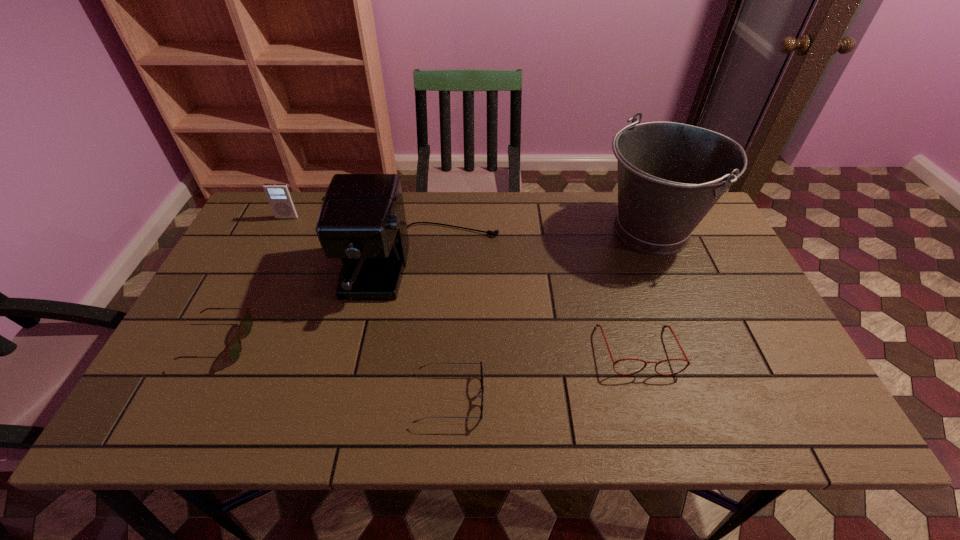
The image size is (960, 540). I want to click on unoccupied area between the iPod and the rightmost spectacles, so click(463, 284).

The image size is (960, 540). Identify the location of vacant space that's between the fourth shortest object and the leftmost spectacles. (253, 280).

Where is `empty space between the iPod and the leftmost spectacles`? empty space between the iPod and the leftmost spectacles is located at coordinates (253, 280).

What are the coordinates of `free point between the bucket and the tallest spectacles` in the screenshot? It's located at (645, 291).

Locate an element on the screen. The width and height of the screenshot is (960, 540). empty space that is in between the third shortest object and the leftmost spectacles is located at coordinates (428, 346).

In order to click on vacant area between the tallest object and the iPod in this screenshot , I will do `click(470, 225)`.

You are a GUI agent. You are given a task and a screenshot of the screen. Output one action in this format:
    pyautogui.click(x=<x>, y=<y>)
    Task: Click on the blank region between the fourth shortest object and the tallest object
    
    Given the screenshot: What is the action you would take?
    pyautogui.click(x=470, y=225)

Where is `free space between the leftmost spectacles and the second spectacles from left to right`? The height and width of the screenshot is (540, 960). free space between the leftmost spectacles and the second spectacles from left to right is located at coordinates (335, 370).

The width and height of the screenshot is (960, 540). Find the location of `the second closest object to the rightmost spectacles`. the second closest object to the rightmost spectacles is located at coordinates (362, 220).

Locate which object is the fifth closest to the iPod. Please provide its 2D coordinates. Your answer should be formatted as a tuple, i.e. [(x, y)], where the tuple contains the x and y coordinates of a point satisfying the conditions above.

[(688, 363)]